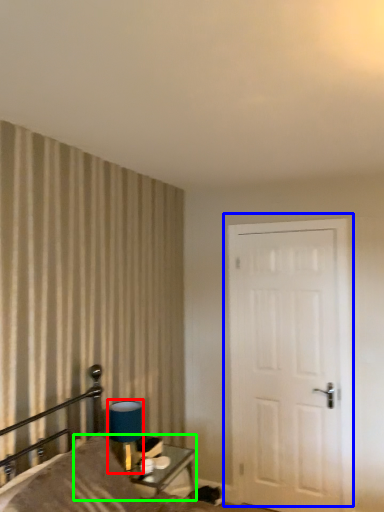
Question: Which is nearer to the table lamp (highlighted by a red box)? door (highlighted by a blue box) or table (highlighted by a green box).

Choices:
 (A) door
 (B) table

Answer: (B)